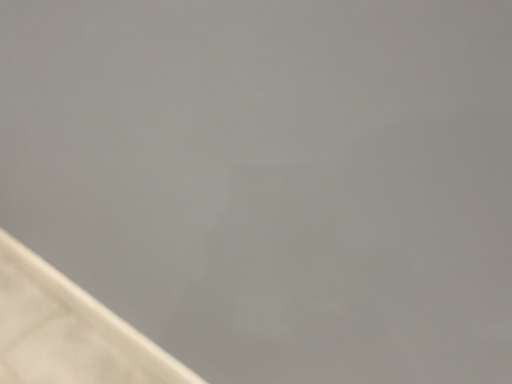
Identify the location of white matte surfboard at lower left. The image size is (512, 384). (69, 331).

The image size is (512, 384). What do you see at coordinates (69, 331) in the screenshot?
I see `white matte surfboard at lower left` at bounding box center [69, 331].

Find the location of a particular element. The width and height of the screenshot is (512, 384). white matte surfboard at lower left is located at coordinates (69, 331).